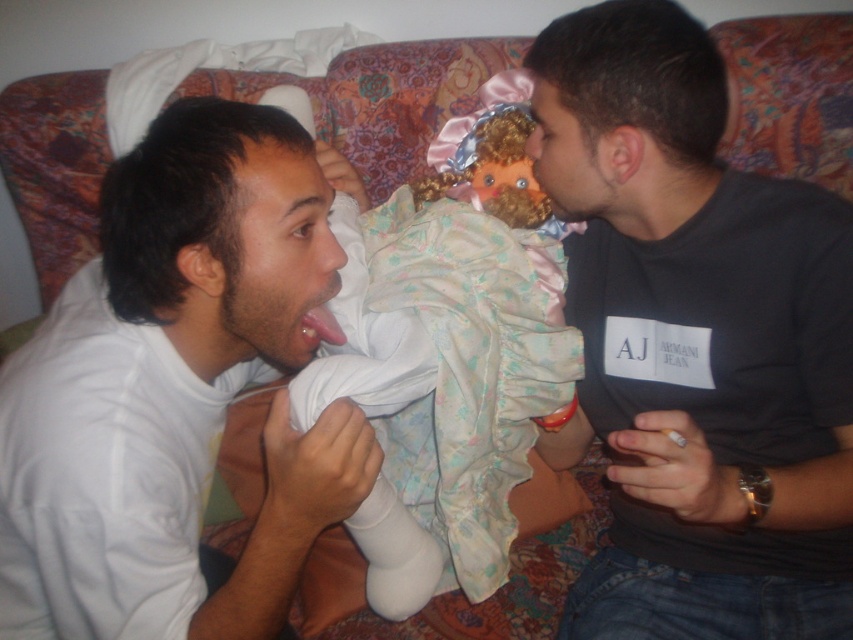
I want to click on silky pastel dress at center, so click(427, 275).

Is silky pastel dress at center below pink glossy tongue at center?

Yes.

Where is `silky pastel dress at center`? The height and width of the screenshot is (640, 853). silky pastel dress at center is located at coordinates (427, 275).

Identify the location of silky pastel dress at center. (427, 275).

What do you see at coordinates (695, 342) in the screenshot?
I see `black matte shirt at center` at bounding box center [695, 342].

Find the location of a particular element. black matte shirt at center is located at coordinates (695, 342).

Is point (721, 540) closer to viewer compared to point (558, 310)?

Yes.

Can you confirm if black matte shirt at center is positioned to the right of silky pastel dress at center?

Indeed, black matte shirt at center is positioned on the right side of silky pastel dress at center.

Which is behind, point (695, 621) or point (439, 348)?

The point (695, 621) is more distant.

Identify the location of black matte shirt at center. The height and width of the screenshot is (640, 853). (695, 342).